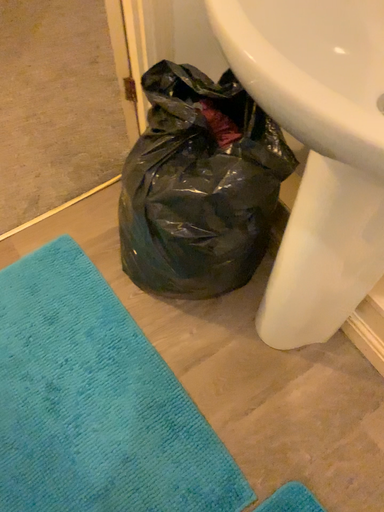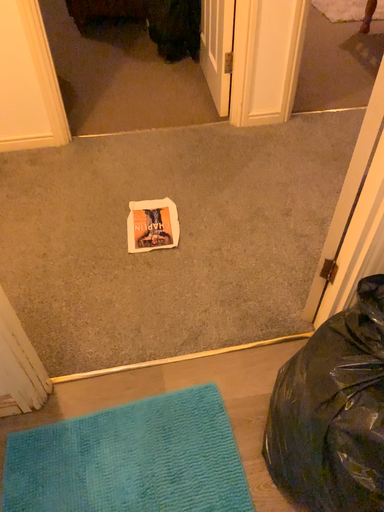
Question: How did the camera likely rotate when shooting the video?

Choices:
 (A) rotated right
 (B) rotated left

Answer: (B)